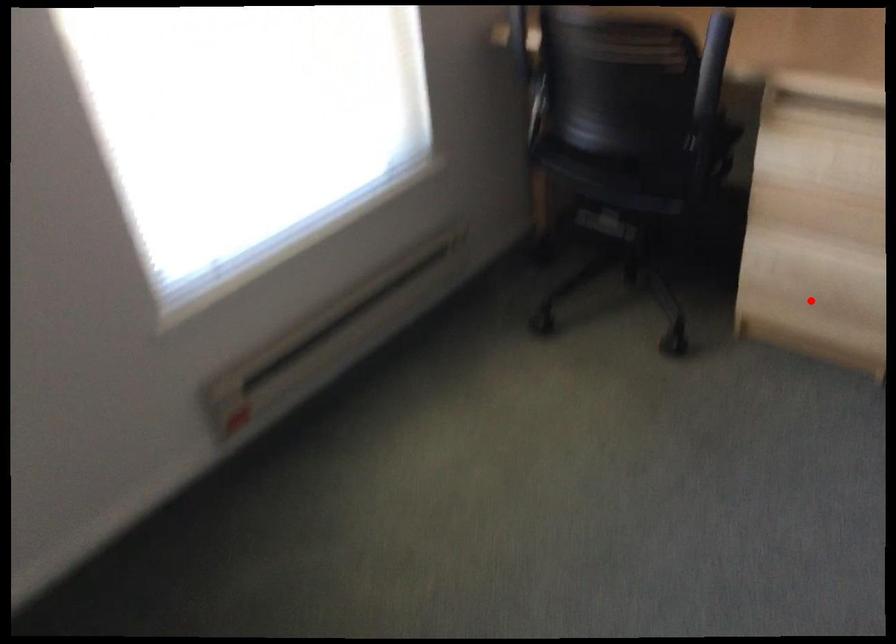
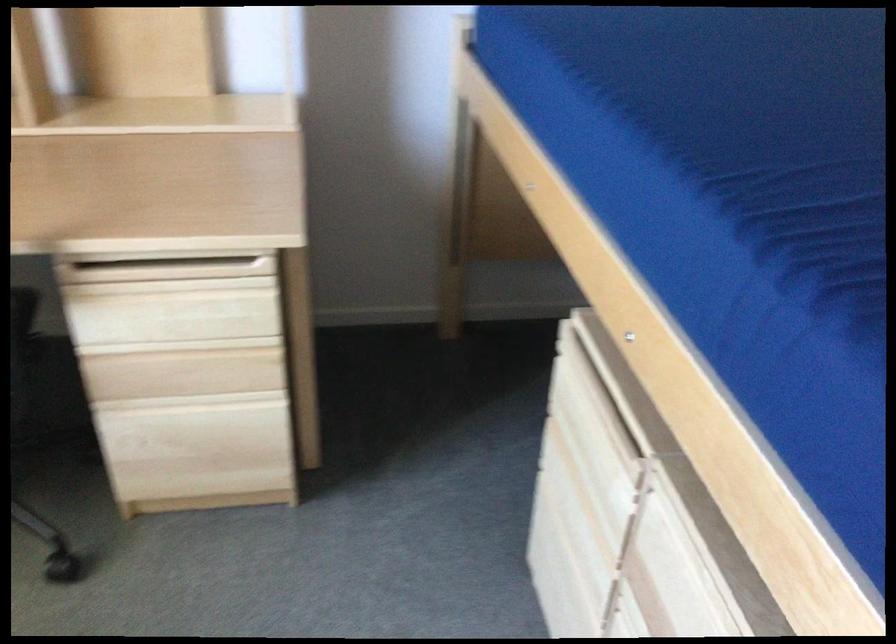
Question: A red point is marked in image1. In image2, is the corresponding 3D point closer to the camera or farther? Reply with the corresponding letter.

Choices:
 (A) The corresponding 3D point is closer.
 (B) The corresponding 3D point is farther.

Answer: (A)